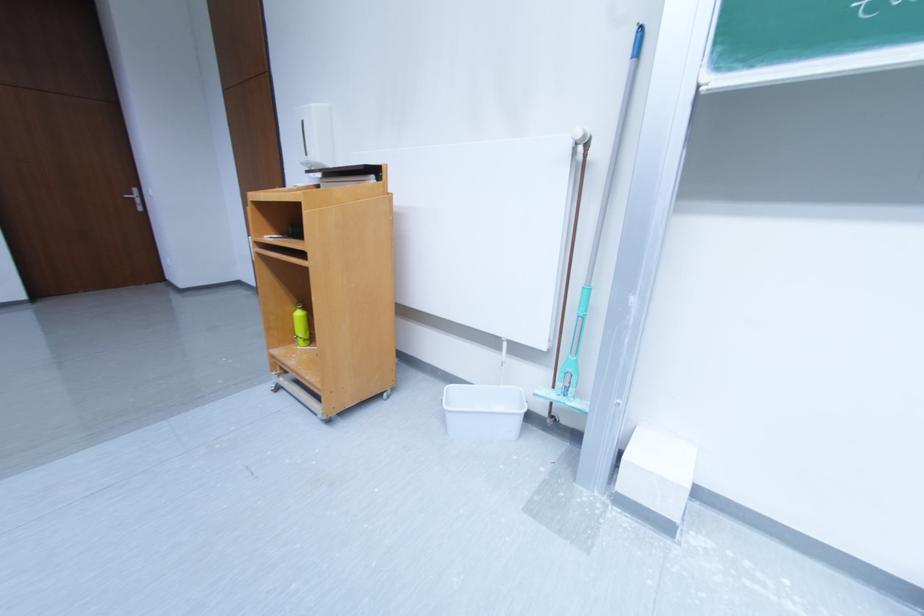
Identify the location of silver door handle. The image size is (924, 616). (132, 195).